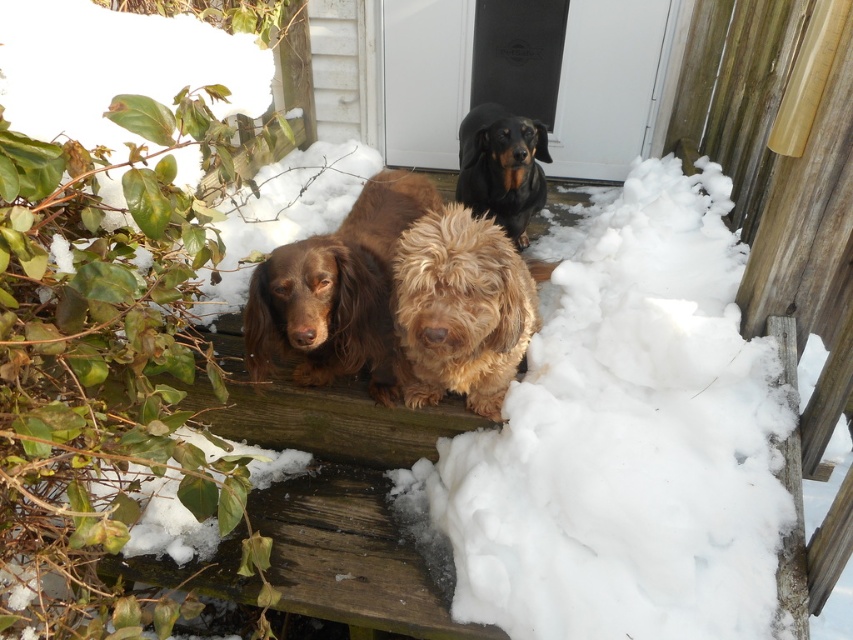
Between white fluffy snow at center and black shiny coat at upper center, which one appears on the left side from the viewer's perspective?

black shiny coat at upper center

Who is shorter, white fluffy snow at center or black shiny coat at upper center?

Standing shorter between the two is black shiny coat at upper center.

The width and height of the screenshot is (853, 640). What do you see at coordinates (622, 440) in the screenshot? I see `white fluffy snow at center` at bounding box center [622, 440].

Image resolution: width=853 pixels, height=640 pixels. In order to click on white fluffy snow at center in this screenshot , I will do `click(622, 440)`.

Consider the image. Is the position of white fluffy snow at center less distant than that of fuzzy golden dog at center?

No, it is not.

Locate an element on the screen. white fluffy snow at center is located at coordinates (622, 440).

Is point (303, 244) farther from viewer compared to point (498, 138)?

No, it is not.

Is brown shaggy dog at center to the right of black shiny coat at upper center from the viewer's perspective?

Result: In fact, brown shaggy dog at center is to the left of black shiny coat at upper center.

Which is behind, point (334, 292) or point (496, 150)?

Point (496, 150)

Identify the location of brown shaggy dog at center. This screenshot has width=853, height=640. (335, 291).